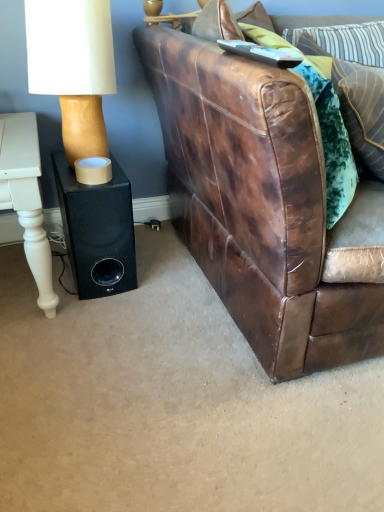
Question: From the image's perspective, relative to white painted wood table at left, is velvet green pillow at upper right, the 1th pillow ordered from the bottom, above or below?

Choices:
 (A) below
 (B) above

Answer: (B)

Question: Is velvet green pillow at upper right, the 1th pillow ordered from the bottom, in front of or behind white painted wood table at left in the image?

Choices:
 (A) behind
 (B) front

Answer: (B)

Question: Estimate the real-world distances between objects in this image. Which object is farther from the green textured pillow at upper right, which is the third pillow in bottom-to-top order?

Choices:
 (A) brown leather couch at right
 (B) black matte speaker at lower left
 (C) white painted wood table at left
 (D) velvet green pillow at upper right, the second pillow viewed from the top
 (E) velvet green pillow at upper right, which is counted as the 3th pillow, starting from the top

Answer: (C)

Question: Which object is positioned closest to the brown leather couch at right?

Choices:
 (A) white painted wood table at left
 (B) velvet green pillow at upper right, which ranks as the 2th pillow in bottom-to-top order
 (C) velvet green pillow at upper right, which is counted as the 3th pillow, starting from the top
 (D) green textured pillow at upper right, which is the third pillow in bottom-to-top order
 (E) white matte lampshade at upper left

Answer: (B)